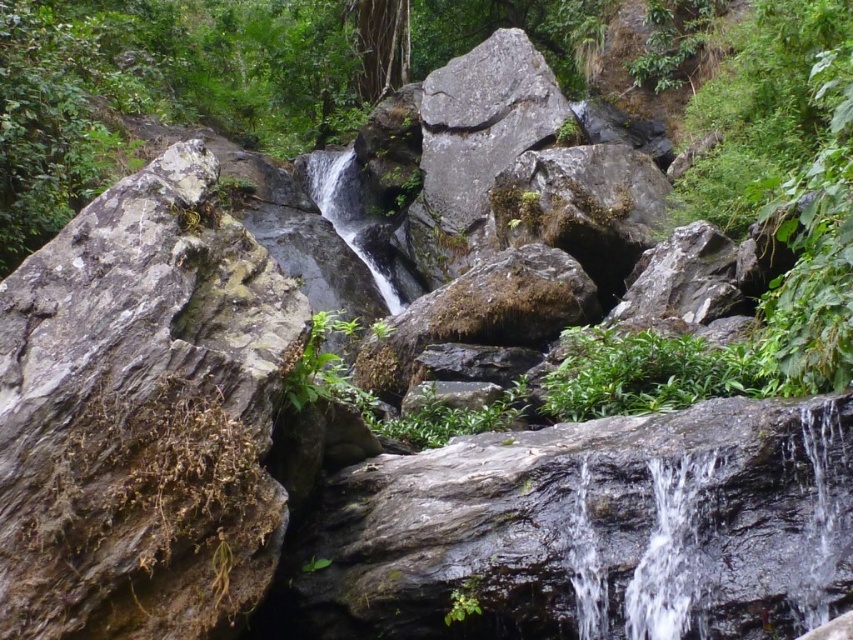
In the scene shown: You are a hiker who wants to place a small flag on the tallest object between the rough gray rock at left and the green leafy plant at center. Which object should you choose?

The rough gray rock at left is taller than the green leafy plant at center, so you should place the flag on the rough gray rock at left.